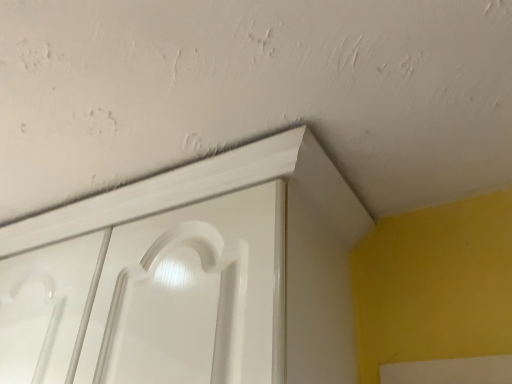
Question: Should I look upward or downward to see white glossy cupboard at center?

Choices:
 (A) down
 (B) up

Answer: (A)